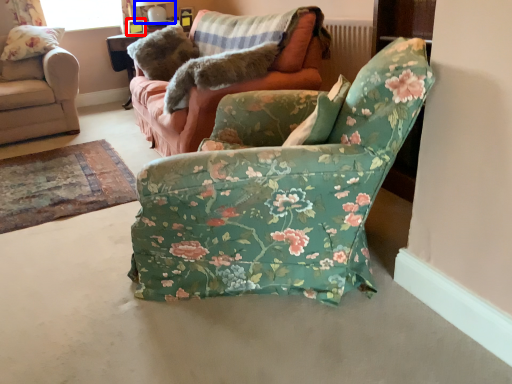
Question: Among these objects, which one is nearest to the camera, picture frame (highlighted by a red box) or lamp (highlighted by a blue box)?

Choices:
 (A) picture frame
 (B) lamp

Answer: (B)